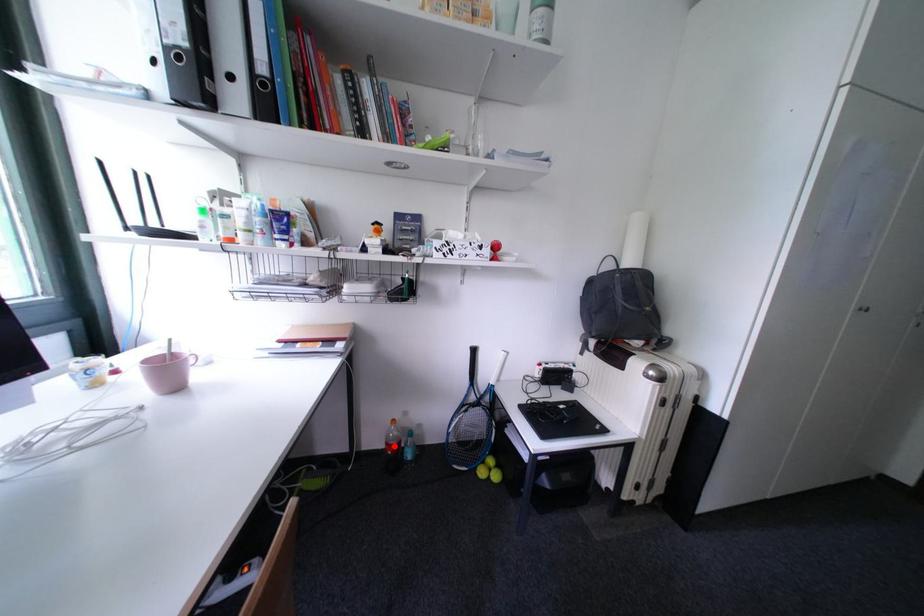
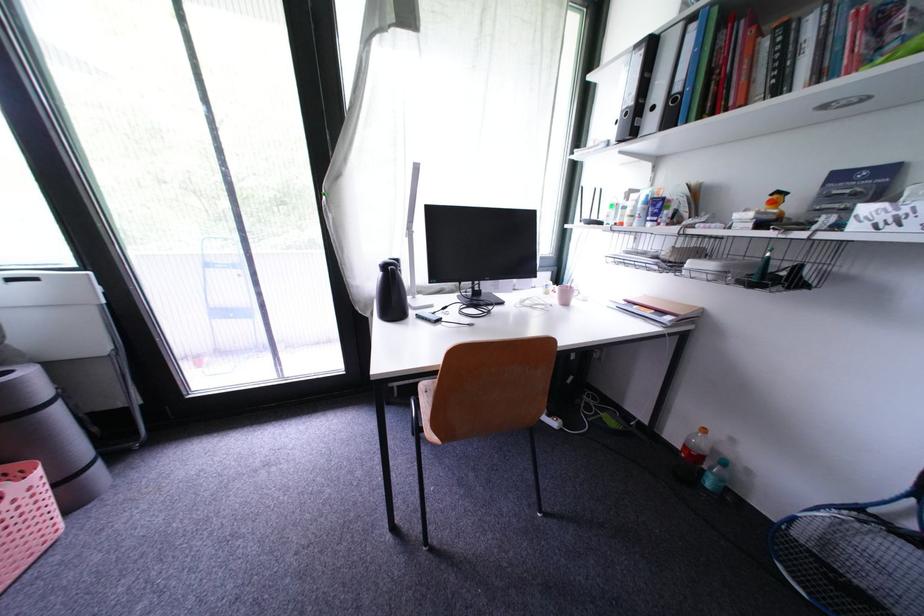
Question: I am providing you with two images of the same scene from different viewpoints. Given a red point in image1, look at the same physical point in image2. Is it:

Choices:
 (A) Closer to the viewpoint
 (B) Farther from the viewpoint

Answer: (A)